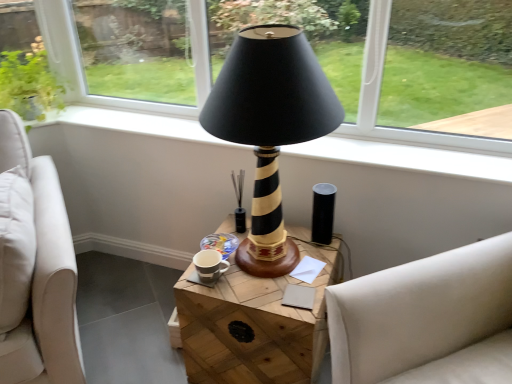
Question: Does white fabric studio couch at right appear on the left side of wooden at center?

Choices:
 (A) no
 (B) yes

Answer: (A)

Question: Is white fabric studio couch at right smaller than wooden at center?

Choices:
 (A) no
 (B) yes

Answer: (A)

Question: Can you confirm if white fabric studio couch at right is taller than wooden at center?

Choices:
 (A) no
 (B) yes

Answer: (B)

Question: Is white fabric studio couch at right looking in the opposite direction of wooden at center?

Choices:
 (A) yes
 (B) no

Answer: (B)

Question: Is white fabric studio couch at right aimed at wooden at center?

Choices:
 (A) no
 (B) yes

Answer: (A)

Question: Based on their positions, is black glossy candle holder at center located to the left or right of black striped wood lamp at center?

Choices:
 (A) left
 (B) right

Answer: (A)

Question: Is black glossy candle holder at center taller or shorter than black striped wood lamp at center?

Choices:
 (A) tall
 (B) short

Answer: (B)

Question: From the image's perspective, relative to black striped wood lamp at center, is black glossy candle holder at center above or below?

Choices:
 (A) below
 (B) above

Answer: (A)

Question: From a real-world perspective, is black glossy candle holder at center above or below black striped wood lamp at center?

Choices:
 (A) below
 (B) above

Answer: (A)

Question: In the image, is white fabric studio couch at right positioned in front of or behind black striped wood lamp at center?

Choices:
 (A) behind
 (B) front

Answer: (B)

Question: Is white fabric studio couch at right to the left or to the right of black striped wood lamp at center in the image?

Choices:
 (A) right
 (B) left

Answer: (A)

Question: In terms of height, does white fabric studio couch at right look taller or shorter compared to black striped wood lamp at center?

Choices:
 (A) tall
 (B) short

Answer: (A)

Question: From a real-world perspective, is white fabric studio couch at right positioned above or below black striped wood lamp at center?

Choices:
 (A) below
 (B) above

Answer: (A)

Question: Looking at the image, does transparent glass at upper left seem bigger or smaller compared to wooden at center?

Choices:
 (A) big
 (B) small

Answer: (B)

Question: Is transparent glass at upper left taller or shorter than wooden at center?

Choices:
 (A) tall
 (B) short

Answer: (A)